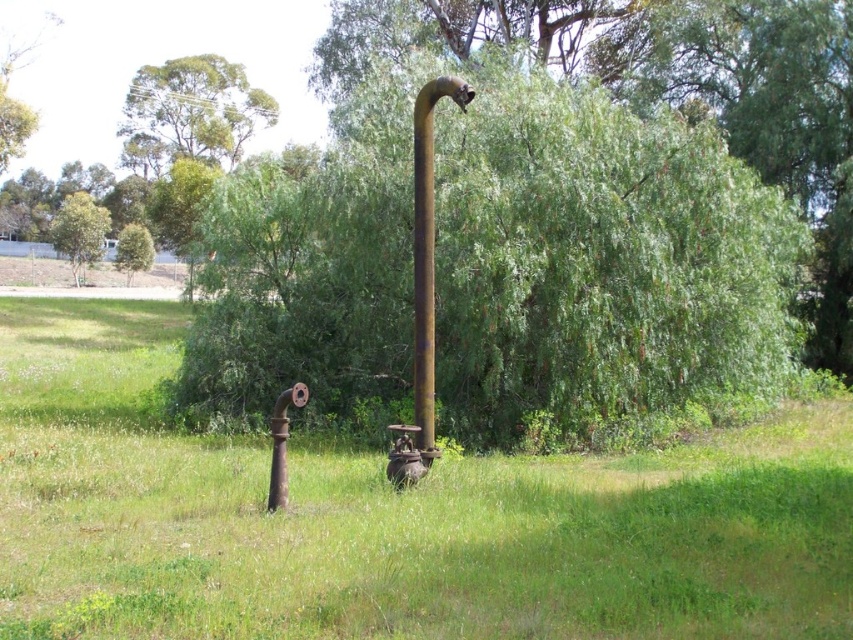
Does green leafy tree at upper left have a lesser width compared to green leafy tree at lower left?

No.

Who is more forward, (76, 202) or (149, 244)?

Point (76, 202) is in front.

The image size is (853, 640). Identify the location of green leafy tree at upper left. (79, 230).

Which is in front, point (430, 128) or point (94, 230)?

Point (430, 128)

Measure the distance from rusty metal pole at center to green leafy tree at upper left.

A distance of 71.79 meters exists between rusty metal pole at center and green leafy tree at upper left.

Is point (416, 397) farther from viewer compared to point (77, 241)?

No, (416, 397) is in front of (77, 241).

Where is `rusty metal pole at center`? rusty metal pole at center is located at coordinates (427, 253).

Does green leafy tree at upper center have a lesser width compared to green leafy tree at upper left?

In fact, green leafy tree at upper center might be wider than green leafy tree at upper left.

Is green leafy tree at upper center to the right of green leafy tree at upper left from the viewer's perspective?

Correct, you'll find green leafy tree at upper center to the right of green leafy tree at upper left.

Between point (248, 88) and point (91, 253), which one is positioned in front?

Point (91, 253)

Where is `green leafy tree at upper center`? Image resolution: width=853 pixels, height=640 pixels. green leafy tree at upper center is located at coordinates (190, 113).